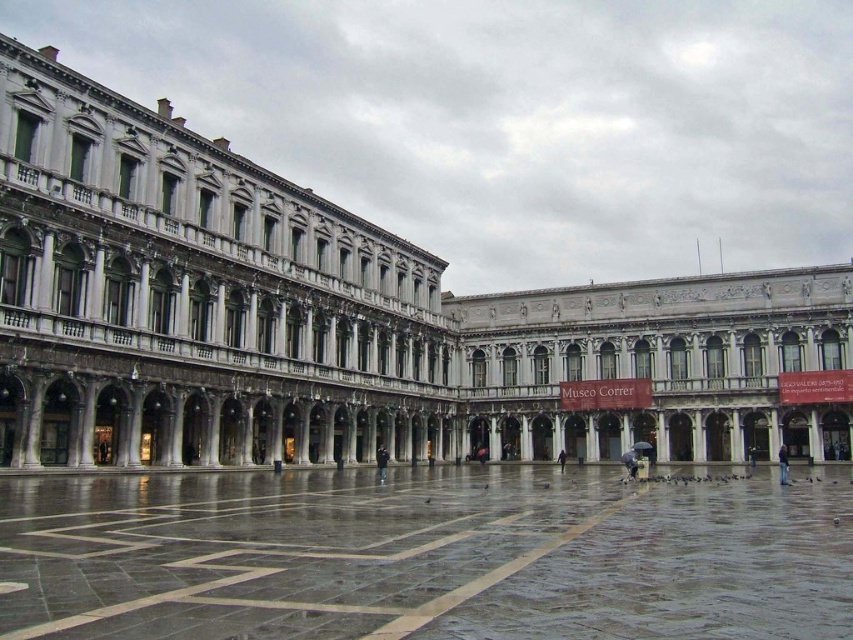
Question: Considering the relative positions of marble floor at center and dark blue fabric at center in the image provided, where is marble floor at center located with respect to dark blue fabric at center?

Choices:
 (A) left
 (B) right

Answer: (A)

Question: Estimate the real-world distances between objects in this image. Which object is closer to the marble floor at center?

Choices:
 (A) dark blue fabric at center
 (B) dark gray fabric jacket at lower right
 (C) dark blue jacket at center

Answer: (C)

Question: Estimate the real-world distances between objects in this image. Which object is farther from the dark blue fabric at center?

Choices:
 (A) dark gray fabric jacket at lower right
 (B) white marble palace at center
 (C) marble floor at center

Answer: (C)

Question: Which object is the closest to the dark blue jacket at center?

Choices:
 (A) dark gray fabric jacket at lower right
 (B) dark blue fabric at center

Answer: (B)

Question: Can you confirm if marble floor at center is wider than dark gray fabric jacket at lower right?

Choices:
 (A) no
 (B) yes

Answer: (B)

Question: Is white marble palace at center bigger than dark blue fabric at center?

Choices:
 (A) no
 (B) yes

Answer: (B)